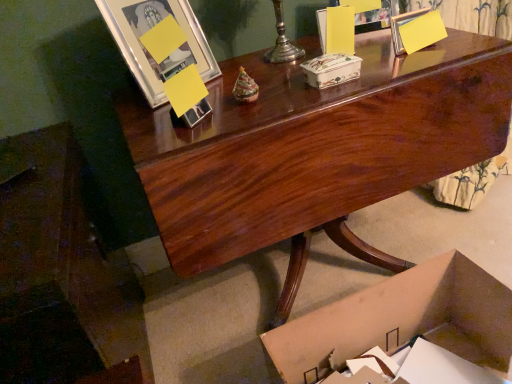
Question: Considering the positions of glossy wood desk at center and porcelain floral box at center, which ranks as the 1th box in top-to-bottom order, in the image, is glossy wood desk at center wider or thinner than porcelain floral box at center, which ranks as the 1th box in top-to-bottom order,?

Choices:
 (A) thin
 (B) wide

Answer: (B)

Question: From their relative heights in the image, would you say glossy wood desk at center is taller or shorter than porcelain floral box at center, which ranks as the 1th box in top-to-bottom order?

Choices:
 (A) tall
 (B) short

Answer: (A)

Question: Which is farther from the glossy wood desk at center?

Choices:
 (A) cardboard box at lower right, placed as the 2th box when sorted from top to bottom
 (B) porcelain floral box at center, which ranks as the 1th box in top-to-bottom order
 (C) matte silver picture frame at upper center, the second picture frame viewed from the front
 (D) metallic silver picture frame at upper left, positioned as the first picture frame in front-to-back order

Answer: (C)

Question: Which is nearer to the cardboard box at lower right, the first box when ordered from bottom to top?

Choices:
 (A) metallic silver picture frame at upper left, marked as the second picture frame in a right-to-left arrangement
 (B) glossy wood desk at center
 (C) porcelain floral box at center, which ranks as the 1th box in top-to-bottom order
 (D) matte silver picture frame at upper center, positioned as the 2th picture frame in left-to-right order

Answer: (B)